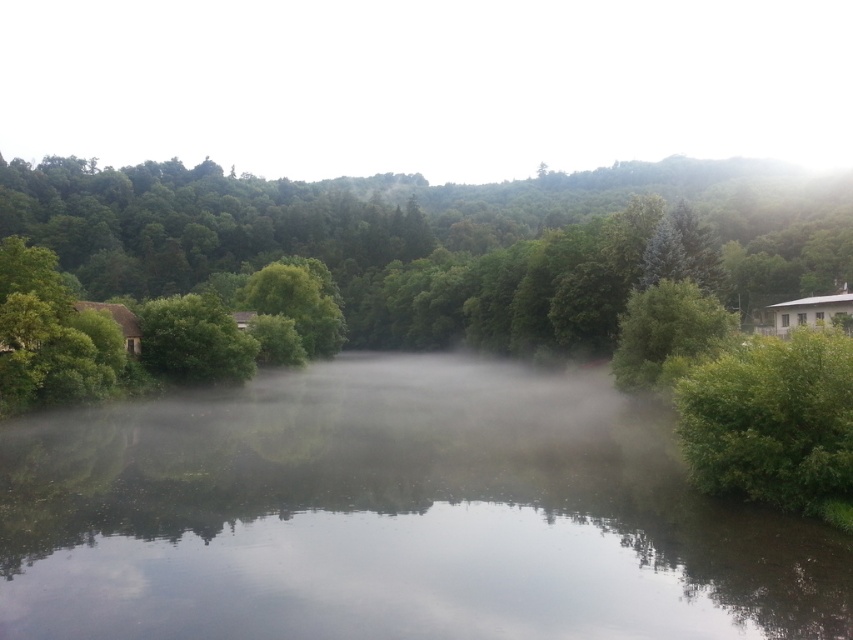
Question: Based on their relative distances, which object is nearer to the green leafy bush at right?

Choices:
 (A) green matte tree at center
 (B) green leafy tree at center right
 (C) green leafy tree at center
 (D) transparent misty river at center

Answer: (D)

Question: Which of these objects is positioned farthest from the green leafy tree at center?

Choices:
 (A) transparent misty river at center
 (B) green leafy tree at center right
 (C) green matte tree at center

Answer: (C)

Question: Can you confirm if transparent misty river at center is positioned above green leafy tree at center?

Choices:
 (A) yes
 (B) no

Answer: (B)

Question: Which object appears closest to the camera in this image?

Choices:
 (A) green leafy bush at right
 (B) green leafy tree at center

Answer: (A)

Question: Does transparent misty river at center have a larger size compared to green leafy tree at center right?

Choices:
 (A) no
 (B) yes

Answer: (B)

Question: Does transparent misty river at center come behind green matte tree at center?

Choices:
 (A) no
 (B) yes

Answer: (A)